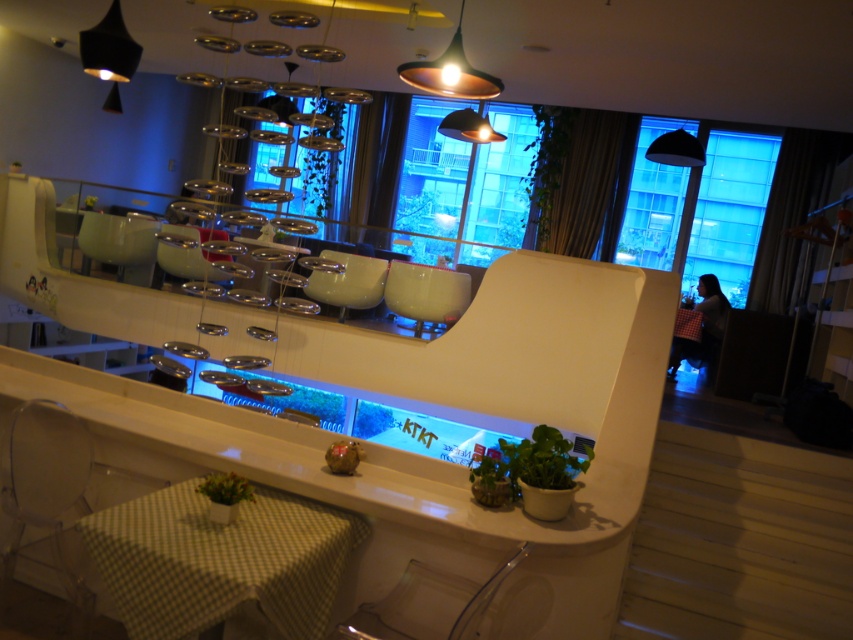
Question: Which point is farther to the camera?

Choices:
 (A) green matte plant at lower center
 (B) metallic copper pendant light at upper center

Answer: (B)

Question: Can you confirm if green matte plant at center is positioned below black matte lampshade at upper right?

Choices:
 (A) no
 (B) yes

Answer: (B)

Question: Which object appears farthest from the camera in this image?

Choices:
 (A) green matte plant at lower center
 (B) green checkered tablecloth at lower left
 (C) black matte lampshade at upper right
 (D) copper metallic pendant light at upper center

Answer: (C)

Question: Can you confirm if green matte plant at center is positioned to the right of black matte lampshade at upper right?

Choices:
 (A) no
 (B) yes

Answer: (A)

Question: Among these points, which one is nearest to the camera?

Choices:
 (A) (482, 77)
 (B) (86, 58)
 (C) (544, 164)

Answer: (A)

Question: Can you confirm if green leafy plant at center is smaller than black matte lampshade at upper right?

Choices:
 (A) yes
 (B) no

Answer: (B)